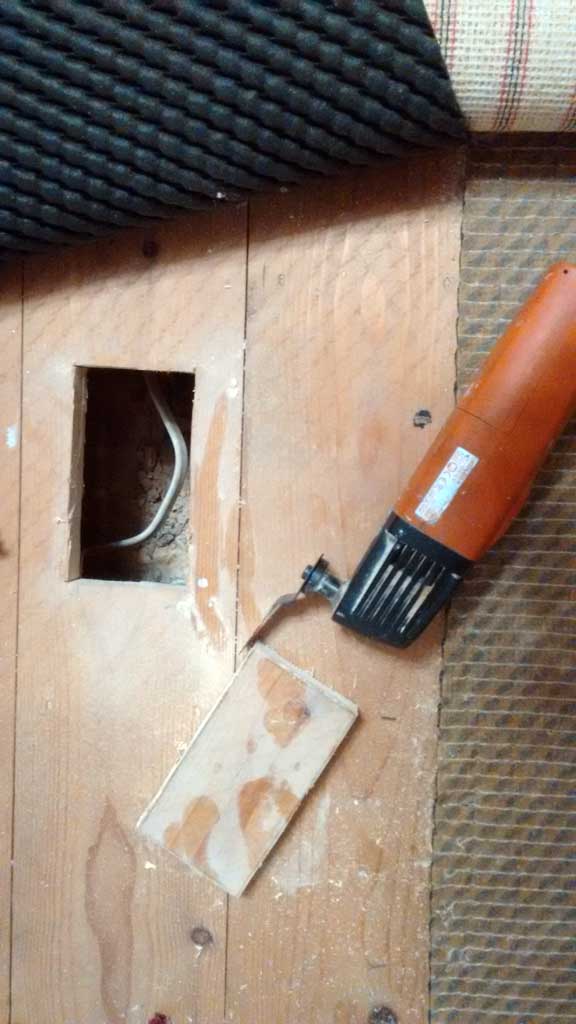
This screenshot has width=576, height=1024. I want to click on carpet, so click(507, 65).